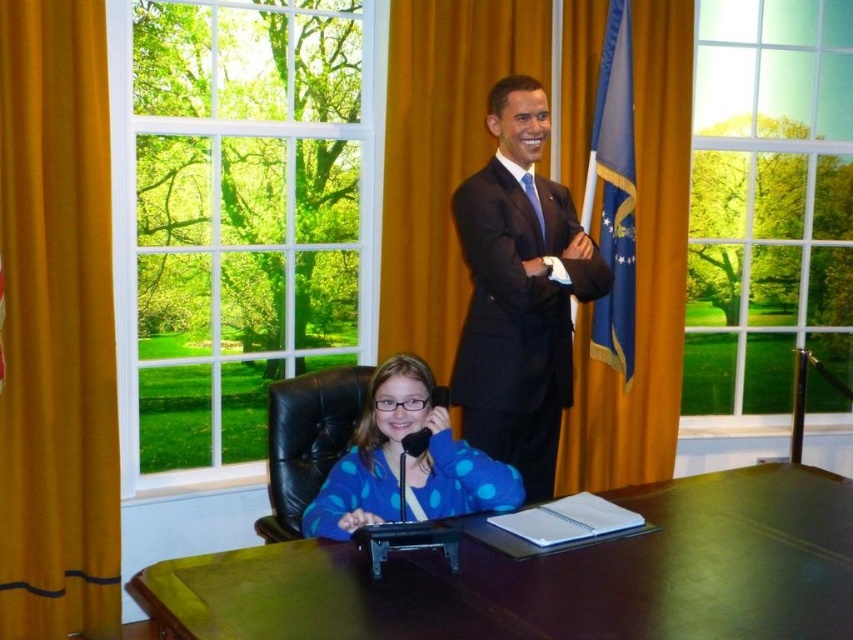
You are a photographer setting up for a group photo in the Oval Office scene. You need to position two subjects so they are exactly 1 meter apart. Given the current positions of the blue fabric flag at right and the blue silk tie at upper center, can you adjust their positions to meet the requirement?

The current distance between the blue fabric flag at right and the blue silk tie at upper center is 76.38 centimeters. To reach exactly 1 meter, you need to increase the distance by 23.62 centimeters.

You are an interior designer assessing the decor of this Oval Office replica. You notice the blue fabric flag at right and the blue silk tie at upper center. Which object is wider in this setup?

The blue fabric flag at right is wider than the blue silk tie at upper center according to the description provided.

You are standing in the Oval Office replica and want to locate the black suit at center. According to the coordinates provided, where should you look?

You should look at point (519, 292) to find the black suit at center.